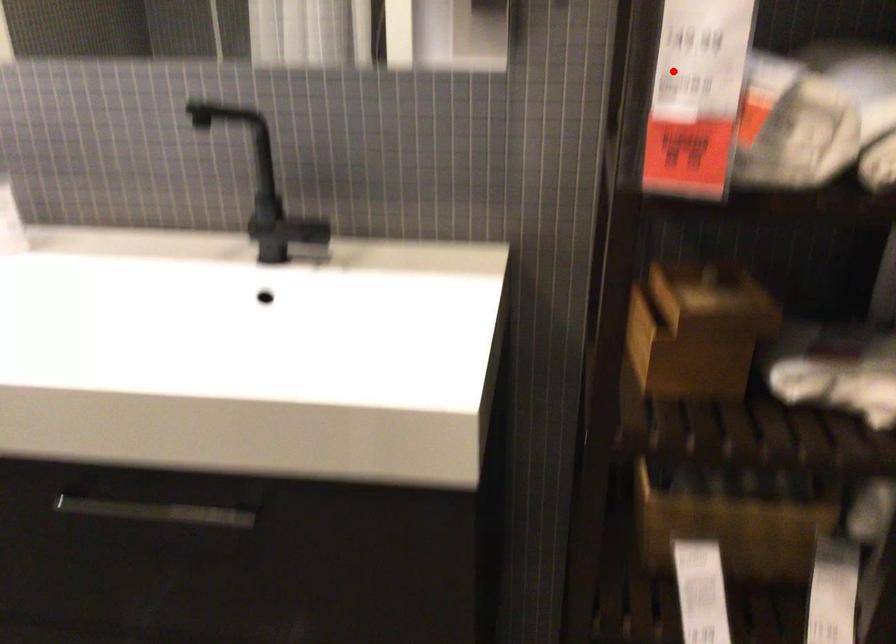
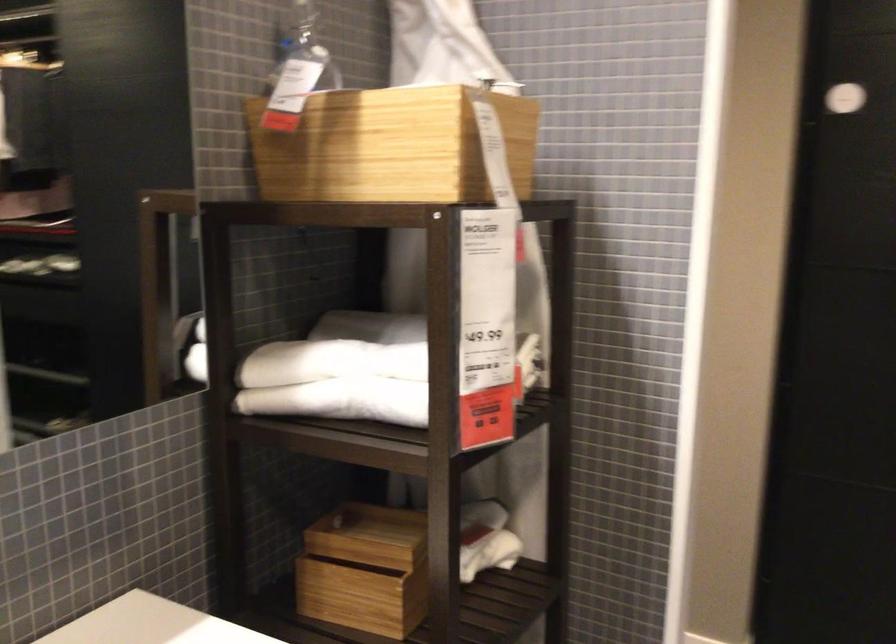
Where in the second image is the point corresponding to the highlighted location from the first image?

(330, 362)